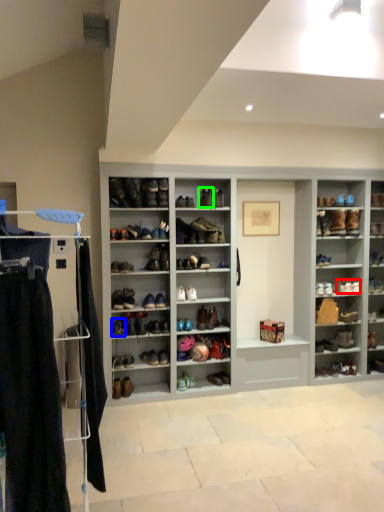
Question: Which object is the closest to the shoe (highlighted by a red box)? Choose among these: shoe (highlighted by a blue box) or shoe (highlighted by a green box).

Choices:
 (A) shoe
 (B) shoe

Answer: (B)